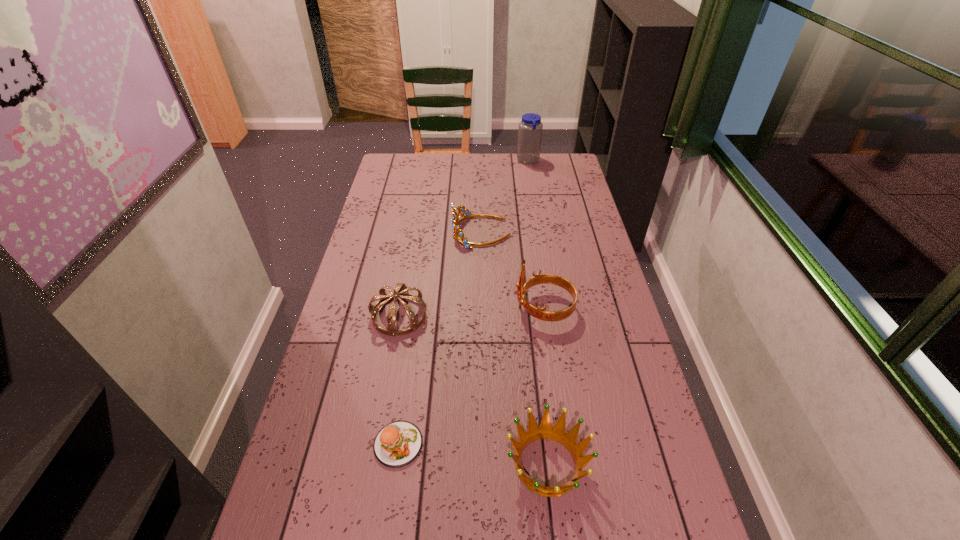
This screenshot has height=540, width=960. What are the coordinates of `water bottle` in the screenshot? It's located at (530, 128).

The width and height of the screenshot is (960, 540). In order to click on the tallest tiara in this screenshot , I will do `click(539, 313)`.

At what (x,y) coordinates should I click in order to perform the action: click on the fifth nearest object. Please return your answer as a coordinate pair (x, y). The image size is (960, 540). Looking at the image, I should click on (458, 234).

Where is `the leftmost tiara`? Image resolution: width=960 pixels, height=540 pixels. the leftmost tiara is located at coordinates (401, 291).

At what (x,y) coordinates should I click in order to perform the action: click on the second shortest object. Please return your answer as a coordinate pair (x, y). Looking at the image, I should click on (558, 433).

Identify the location of the shortest object. The height and width of the screenshot is (540, 960). (397, 444).

The height and width of the screenshot is (540, 960). Find the location of `vacant area situated with a carrying loop on the side of the farthest object`. vacant area situated with a carrying loop on the side of the farthest object is located at coordinates (444, 161).

Identify the location of blank space located with a carrying loop on the side of the farthest object. The image size is (960, 540). (498, 161).

Identify the location of vacant space located with a carrying loop on the side of the farthest object. This screenshot has width=960, height=540. (492, 161).

Identify the location of vacant space located on the front-facing side of the tallest tiara. (443, 308).